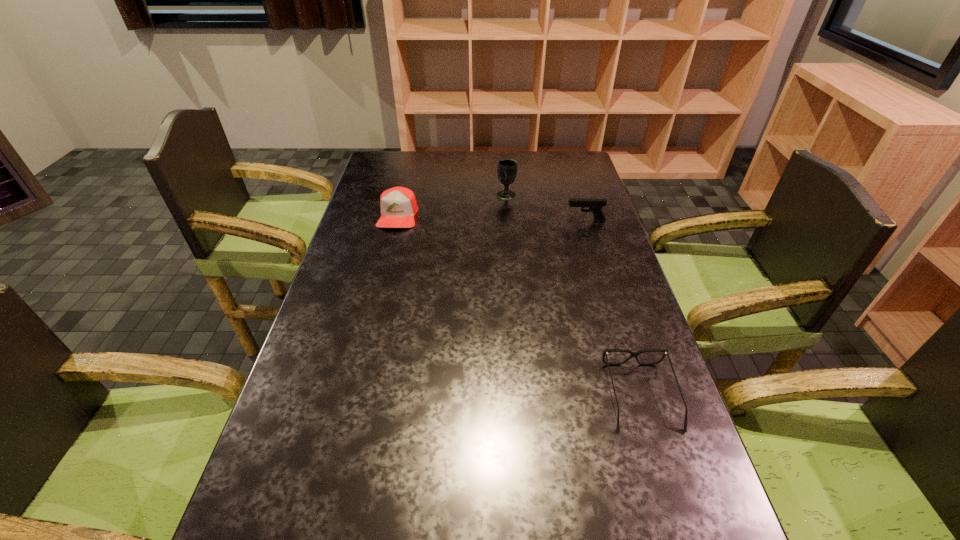
Find the location of `free space between the spectacles and the leftmost object`. free space between the spectacles and the leftmost object is located at coordinates (519, 306).

The height and width of the screenshot is (540, 960). Identify the location of free space between the pistol and the baseball cap. (492, 218).

Find the location of a particular element. This screenshot has width=960, height=540. free space between the leftmost object and the spectacles is located at coordinates (519, 306).

You are a GUI agent. You are given a task and a screenshot of the screen. Output one action in this format:
    pyautogui.click(x=<x>, y=<y>)
    Task: Click on the unoccupied area between the shortest object and the farthest object
    
    Given the screenshot: What is the action you would take?
    pyautogui.click(x=573, y=296)

You are a GUI agent. You are given a task and a screenshot of the screen. Output one action in this format:
    pyautogui.click(x=<x>, y=<y>)
    Task: Click on the blank region between the pistol and the leftmost object
    The height and width of the screenshot is (540, 960).
    Given the screenshot: What is the action you would take?
    (492, 218)

Image resolution: width=960 pixels, height=540 pixels. I want to click on vacant space that's between the pistol and the nearest object, so click(x=612, y=308).

This screenshot has height=540, width=960. Find the location of `vacant region between the farthest object and the pistol`. vacant region between the farthest object and the pistol is located at coordinates (546, 208).

The height and width of the screenshot is (540, 960). Identify the location of vacant space that is in between the nearest object and the pistol. (612, 308).

Locate an element on the screen. The height and width of the screenshot is (540, 960). vacant area that lies between the shortest object and the farthest object is located at coordinates (573, 296).

Locate an element on the screen. object that is the closest to the shortest object is located at coordinates (595, 205).